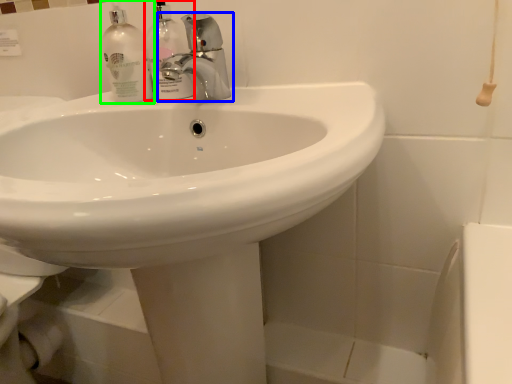
Question: Which object is positioned farthest from cleaning product (highlighted by a red box)? Select from tap (highlighted by a blue box) and cleaning product (highlighted by a green box).

Choices:
 (A) tap
 (B) cleaning product

Answer: (A)